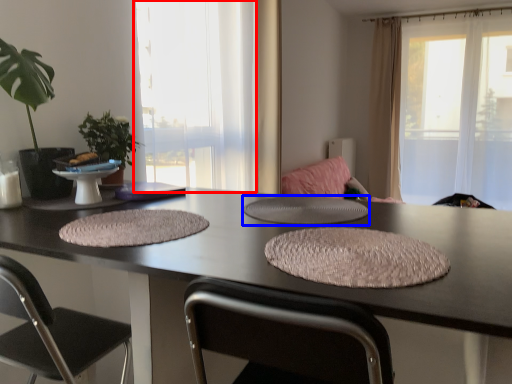
Question: Among these objects, which one is nearest to the camera, window (highlighted by a red box) or round table (highlighted by a blue box)?

Choices:
 (A) window
 (B) round table

Answer: (B)